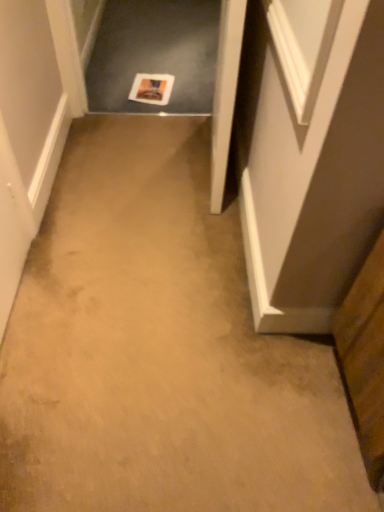
Question: Does wooden cabinet at lower right touch white paper at center?

Choices:
 (A) yes
 (B) no

Answer: (B)

Question: Is the depth of wooden cabinet at lower right less than that of white paper at center?

Choices:
 (A) no
 (B) yes

Answer: (B)

Question: Is wooden cabinet at lower right aimed at white paper at center?

Choices:
 (A) no
 (B) yes

Answer: (A)

Question: Does wooden cabinet at lower right have a lesser height compared to white paper at center?

Choices:
 (A) no
 (B) yes

Answer: (A)

Question: Does wooden cabinet at lower right have a larger size compared to white paper at center?

Choices:
 (A) no
 (B) yes

Answer: (B)

Question: Is wooden cabinet at lower right surrounding white paper at center?

Choices:
 (A) no
 (B) yes

Answer: (A)

Question: From a real-world perspective, is white wood door at center positioned under white paper at center based on gravity?

Choices:
 (A) no
 (B) yes

Answer: (A)

Question: Can you confirm if white wood door at center is taller than white paper at center?

Choices:
 (A) no
 (B) yes

Answer: (B)

Question: From the image's perspective, does white wood door at center appear lower than white paper at center?

Choices:
 (A) yes
 (B) no

Answer: (A)

Question: Considering the relative sizes of white wood door at center and white paper at center in the image provided, is white wood door at center bigger than white paper at center?

Choices:
 (A) no
 (B) yes

Answer: (B)

Question: Is white wood door at center not inside white paper at center?

Choices:
 (A) yes
 (B) no

Answer: (A)

Question: Is white wood door at center beside white paper at center?

Choices:
 (A) no
 (B) yes

Answer: (A)

Question: Is white paper at center in front of white wood door at center?

Choices:
 (A) yes
 (B) no

Answer: (B)